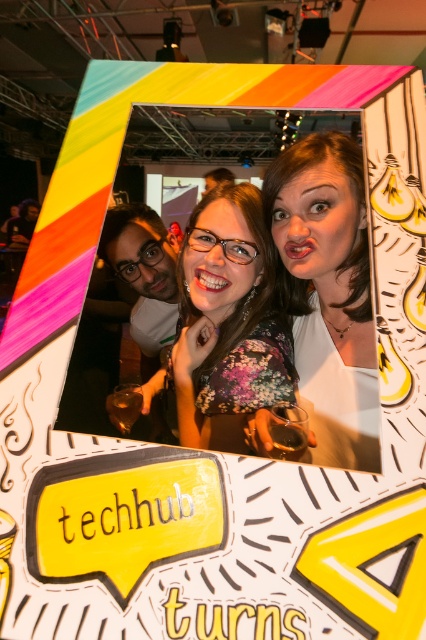
Question: From the image, what is the correct spatial relationship of matte white face at center in relation to matte white man at left?

Choices:
 (A) above
 (B) below

Answer: (A)

Question: Does floral fabric dress at center appear on the right side of matte white man at left?

Choices:
 (A) yes
 (B) no

Answer: (A)

Question: Which object is positioned closest to the matte white face at center?

Choices:
 (A) matte white man at left
 (B) floral fabric dress at center

Answer: (B)

Question: Among these points, which one is farthest from the camera?

Choices:
 (A) (137, 305)
 (B) (340, 364)

Answer: (A)

Question: Can you confirm if floral fabric dress at center is positioned below matte white man at left?

Choices:
 (A) no
 (B) yes

Answer: (B)

Question: Which is farther from the floral fabric dress at center?

Choices:
 (A) matte white face at center
 (B) matte white man at left

Answer: (B)